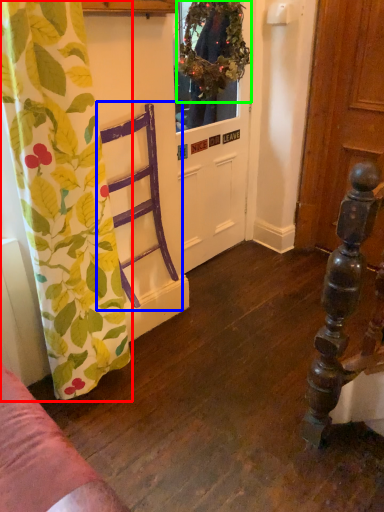
Question: Considering the real-world distances, which object is farthest from curtain (highlighted by a red box)? armchair (highlighted by a blue box) or floral arrangement (highlighted by a green box)?

Choices:
 (A) armchair
 (B) floral arrangement

Answer: (B)